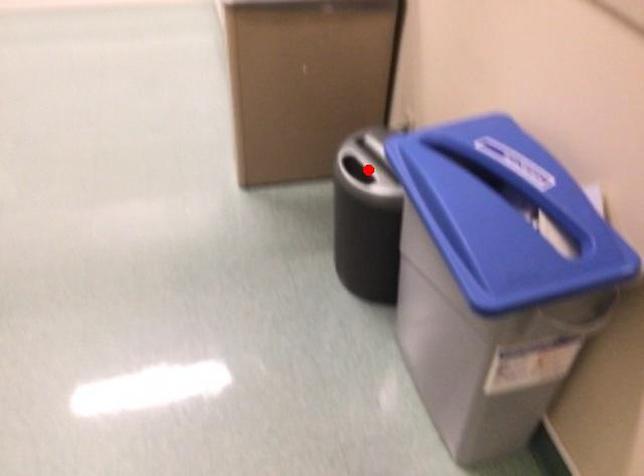
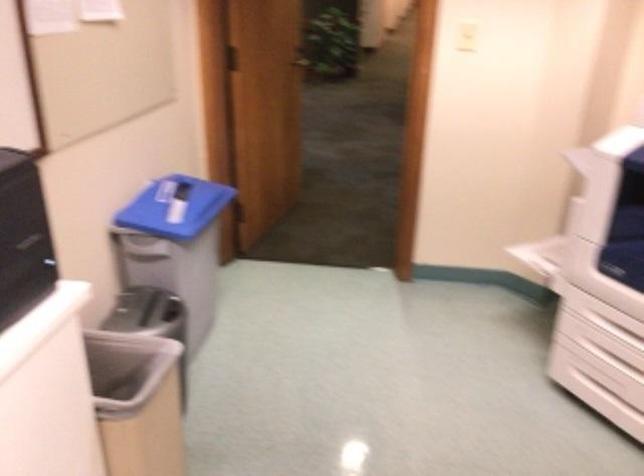
Question: I am providing you with two images of the same scene from different viewpoints. Image1 has a red point marked. In image2, the corresponding 3D location appears at what relative position? Reply with the corresponding letter.

Choices:
 (A) Closer
 (B) Farther

Answer: (B)